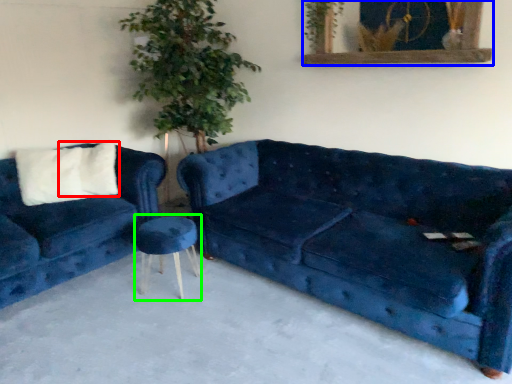
Question: Considering the real-world distances, which object is closest to pillow (highlighted by a red box)? picture frame (highlighted by a blue box) or stool (highlighted by a green box).

Choices:
 (A) picture frame
 (B) stool

Answer: (B)